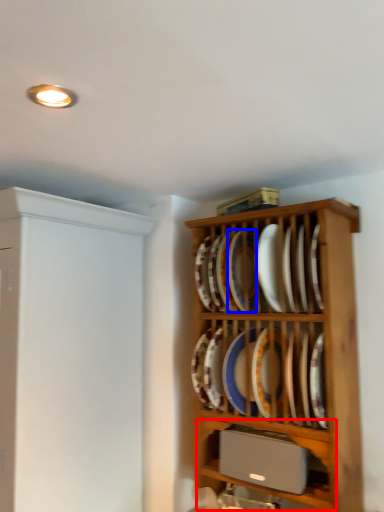
Question: Which point is closer to the camera, shelf (highlighted by a red box) or platter (highlighted by a blue box)?

Choices:
 (A) shelf
 (B) platter

Answer: (A)